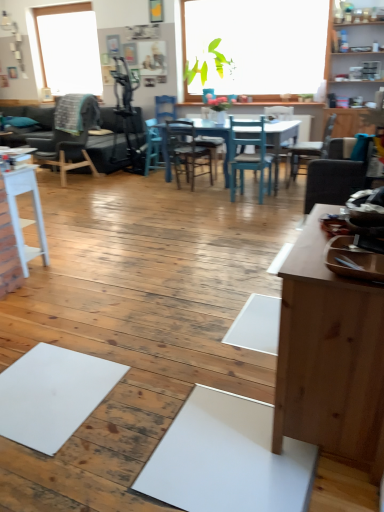
Question: Considering the positions of dark brown wooden chair at left, the sixth chair when ordered from right to left, and wooden chair at center, the fourth chair viewed from the right, in the image, is dark brown wooden chair at left, the sixth chair when ordered from right to left, bigger or smaller than wooden chair at center, the fourth chair viewed from the right,?

Choices:
 (A) small
 (B) big

Answer: (B)

Question: From the image's perspective, is dark brown wooden chair at left, which is the first chair in left-to-right order, located above or below wooden chair at center, which ranks as the third chair in left-to-right order?

Choices:
 (A) below
 (B) above

Answer: (B)

Question: Which object is the farthest from the wooden chair at right, the 1th chair viewed from the right?

Choices:
 (A) light brown wood desk at right
 (B) wooden chair at center, which ranks as the third chair in left-to-right order
 (C) teal wood chair at center, the fourth chair from the left
 (D) suede-like gray chair at right, arranged as the second chair when viewed from the right
 (E) white matte table at left

Answer: (A)

Question: Estimate the real-world distances between objects in this image. Which object is closer to the dark gray leather couch at left?

Choices:
 (A) light brown wood desk at right
 (B) white matte table at left
 (C) teal wood chair at center, the fourth chair from the left
 (D) wooden chair at center, which ranks as the third chair in left-to-right order
 (E) wooden chair at right, the 6th chair positioned from the left

Answer: (D)